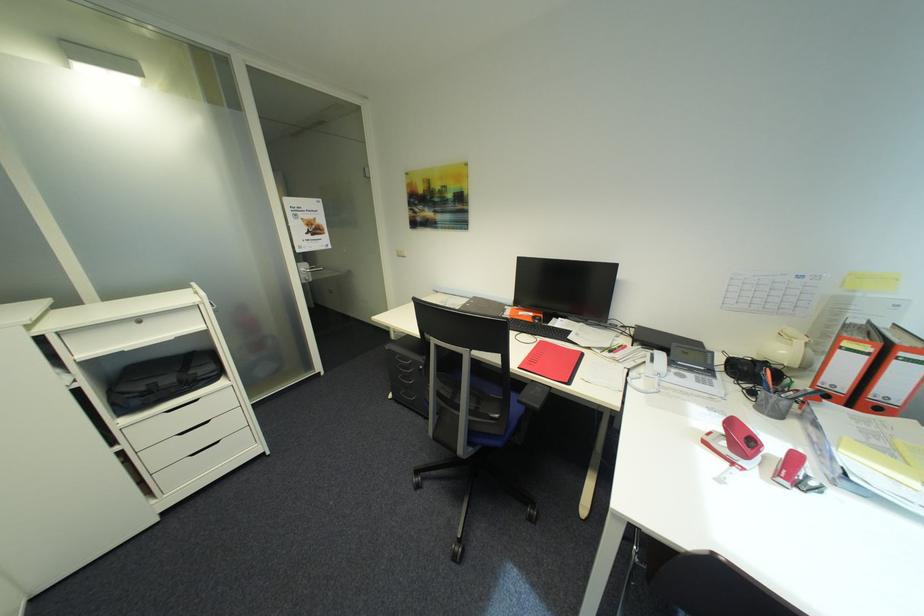
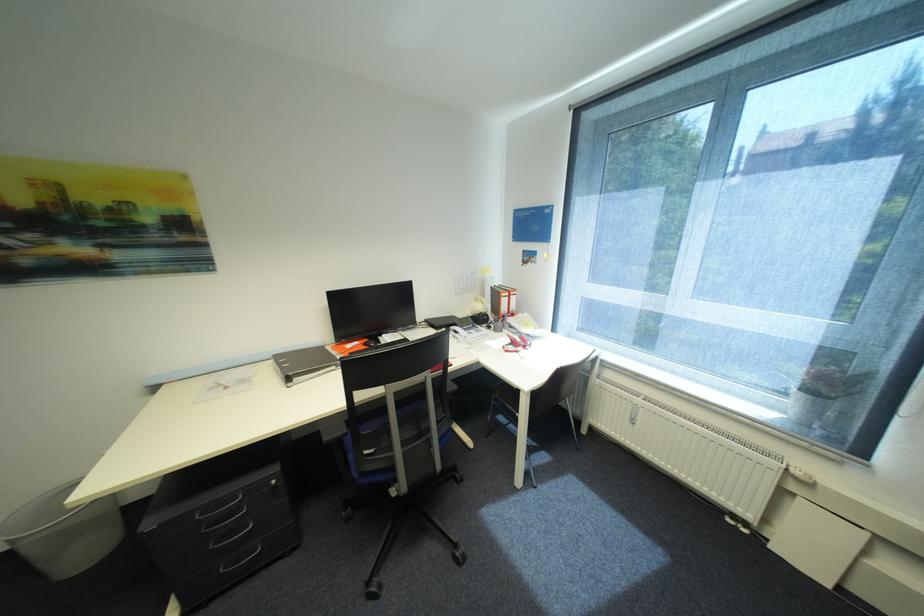
In the second image, find the point that corresponds to point 409,392 in the first image.

(229, 570)